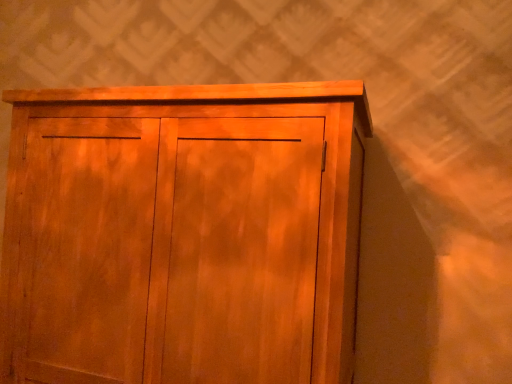
Locate an element on the screen. Image resolution: width=512 pixels, height=384 pixels. wooden cupboard at center is located at coordinates (182, 229).

Image resolution: width=512 pixels, height=384 pixels. Describe the element at coordinates (182, 229) in the screenshot. I see `wooden cupboard at center` at that location.

Identify the location of wooden cupboard at center. (182, 229).